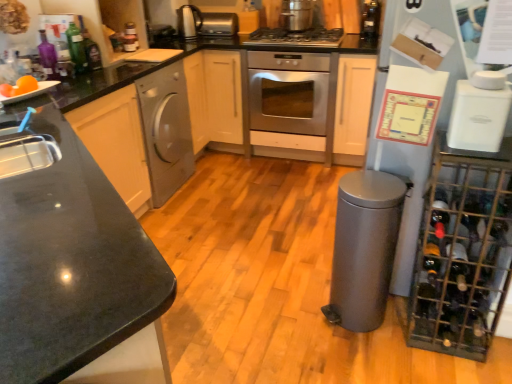
This screenshot has width=512, height=384. In order to click on purple glass bottle at upper left, the first bottle in the front-to-back sequence in this screenshot , I will do `click(48, 56)`.

The width and height of the screenshot is (512, 384). What do you see at coordinates (73, 265) in the screenshot?
I see `black granite countertop at left` at bounding box center [73, 265].

What do you see at coordinates (466, 251) in the screenshot?
I see `metallic wire wine rack at right` at bounding box center [466, 251].

What are the coordinates of `metallic gray refrigerator at right` in the screenshot? It's located at (412, 62).

Locate an element on the screen. Image resolution: width=512 pixels, height=384 pixels. dark glass wine bottle at lower right is located at coordinates (458, 259).

This screenshot has height=384, width=512. Identify the location of purple glass bottle at upper left, arranged as the 4th bottle when viewed from the right. (48, 56).

Based on the photo, considering the relative positions of white plastic appliance at upper right, acting as the second kitchen appliance starting from the left, and stainless steel gas stove at center in the image provided, is white plastic appliance at upper right, acting as the second kitchen appliance starting from the left, to the right of stainless steel gas stove at center from the viewer's perspective?

Correct, you'll find white plastic appliance at upper right, acting as the second kitchen appliance starting from the left, to the right of stainless steel gas stove at center.

Considering the sizes of objects white plastic appliance at upper right, positioned as the first kitchen appliance in front-to-back order, and stainless steel gas stove at center in the image provided, who is wider, white plastic appliance at upper right, positioned as the first kitchen appliance in front-to-back order, or stainless steel gas stove at center?

With larger width is stainless steel gas stove at center.

Is white plastic appliance at upper right, the 1th kitchen appliance when ordered from right to left, inside the boundaries of stainless steel gas stove at center, or outside?

white plastic appliance at upper right, the 1th kitchen appliance when ordered from right to left, is located beyond the bounds of stainless steel gas stove at center.

Is polished stainless steel kettle at upper left, acting as the 3th appliance starting from the right, far away from translucent glass bottle at upper right, positioned as the first bottle in back-to-front order?

Yes, polished stainless steel kettle at upper left, acting as the 3th appliance starting from the right, and translucent glass bottle at upper right, positioned as the first bottle in back-to-front order, are located far from each other.

From the picture: What's the angular difference between polished stainless steel kettle at upper left, which ranks as the 1th appliance in left-to-right order, and translucent glass bottle at upper right, placed as the fourth bottle when sorted from left to right,'s facing directions?

There is a 1.93-degree angle between the facing directions of polished stainless steel kettle at upper left, which ranks as the 1th appliance in left-to-right order, and translucent glass bottle at upper right, placed as the fourth bottle when sorted from left to right.

Is the depth of polished stainless steel kettle at upper left, acting as the 3th appliance starting from the right, greater than that of translucent glass bottle at upper right, placed as the fourth bottle when sorted from left to right?

That is True.

Looking at this image, between polished stainless steel kettle at upper left, acting as the 3th appliance starting from the right, and translucent glass bottle at upper right, the first bottle in the right-to-left sequence, which one has more height?

Standing taller between the two is translucent glass bottle at upper right, the first bottle in the right-to-left sequence.

From a real-world perspective, between polished stainless steel kettle at upper left, arranged as the second appliance when viewed from the back, and stainless steel pot at upper center, which ranks as the 1th kitchen appliance in left-to-right order, who is vertically lower?

From a 3D spatial view, stainless steel pot at upper center, which ranks as the 1th kitchen appliance in left-to-right order, is below.

Is polished stainless steel kettle at upper left, which ranks as the 1th appliance in left-to-right order, facing away from stainless steel pot at upper center, which is the first kitchen appliance from back to front?

polished stainless steel kettle at upper left, which ranks as the 1th appliance in left-to-right order, does not have its back to stainless steel pot at upper center, which is the first kitchen appliance from back to front.

You are a GUI agent. You are given a task and a screenshot of the screen. Output one action in this format:
    pyautogui.click(x=<x>, y=<y>)
    Task: Click on the 2nd appliance to the left of the stainless steel pot at upper center, the 2th kitchen appliance in the front-to-back sequence, counting from the anchor's position
    The width and height of the screenshot is (512, 384).
    Given the screenshot: What is the action you would take?
    pyautogui.click(x=189, y=22)

Measure the distance between polished stainless steel kettle at upper left, acting as the 3th appliance starting from the right, and stainless steel pot at upper center, which is the first kitchen appliance from back to front.

29.72 inches.

Consider the image. From a real-world perspective, between satin silver trash can at lower right, arranged as the 1th appliance when viewed from the front, and black granite countertop at left, who is vertically lower?

satin silver trash can at lower right, arranged as the 1th appliance when viewed from the front, is physically lower.

Which is less distant, (381, 299) or (57, 137)?

The point (381, 299) is closer.

Is satin silver trash can at lower right, arranged as the 1th appliance when viewed from the front, in front of or behind black granite countertop at left in the image?

Clearly, satin silver trash can at lower right, arranged as the 1th appliance when viewed from the front, is behind black granite countertop at left.

Which of these two, satin silver trash can at lower right, arranged as the 1th appliance when ordered from the bottom, or black granite countertop at left, stands taller?

black granite countertop at left.

The height and width of the screenshot is (384, 512). What are the coordinates of `wine rack that is in front of the polished stainless steel kettle at upper left, acting as the 3th appliance starting from the right` in the screenshot? It's located at (466, 251).

Is metallic wire wine rack at right facing towards polished stainless steel kettle at upper left, arranged as the second appliance when viewed from the back?

No, metallic wire wine rack at right is not turned towards polished stainless steel kettle at upper left, arranged as the second appliance when viewed from the back.

Looking at the image, does metallic wire wine rack at right seem bigger or smaller compared to polished stainless steel kettle at upper left, which ranks as the 1th appliance in left-to-right order?

Considering their sizes, metallic wire wine rack at right takes up more space than polished stainless steel kettle at upper left, which ranks as the 1th appliance in left-to-right order.

Considering the points (495, 178) and (180, 36), which point is behind, point (495, 178) or point (180, 36)?

The point (180, 36) is farther from the camera.

Is stainless steel gas stove at center next to metallic gray refrigerator at right?

No.

From the image's perspective, would you say stainless steel gas stove at center is shown under metallic gray refrigerator at right?

Incorrect, from the image's perspective, stainless steel gas stove at center is higher than metallic gray refrigerator at right.

Which of these two, stainless steel gas stove at center or metallic gray refrigerator at right, is wider?

Wider between the two is stainless steel gas stove at center.

Is stainless steel gas stove at center oriented towards metallic gray refrigerator at right?

No, stainless steel gas stove at center is not facing towards metallic gray refrigerator at right.

Is white plastic appliance at upper right, the second kitchen appliance viewed from the top, at the right side of orange matte at left?

Indeed, white plastic appliance at upper right, the second kitchen appliance viewed from the top, is positioned on the right side of orange matte at left.

Between white plastic appliance at upper right, acting as the second kitchen appliance starting from the left, and orange matte at left, which one has less height?

Standing shorter between the two is orange matte at left.

Between white plastic appliance at upper right, the second kitchen appliance viewed from the top, and orange matte at left, which one has smaller size?

orange matte at left.

This screenshot has width=512, height=384. What are the coordinates of `kitchen appliance in front of the stainless steel gas stove at center` in the screenshot? It's located at (478, 118).

From a real-world perspective, starting from the translucent glass bottle at upper right, positioned as the first bottle in back-to-front order, which appliance is the 1st one below it? Please provide its 2D coordinates.

[(189, 22)]

From the image, which object appears to be farther from metallic wire wine rack at right, black granite countertop at left or satin silver trash can at lower right, the 3th appliance viewed from the back?

Based on the image, black granite countertop at left appears to be further to metallic wire wine rack at right.

Estimate the real-world distances between objects in this image. Which object is further from satin silver trash can at lower right, arranged as the 1th appliance when ordered from the bottom, stainless steel pot at upper center, the 2th kitchen appliance in the front-to-back sequence, or stainless steel gas stove at center?

stainless steel pot at upper center, the 2th kitchen appliance in the front-to-back sequence, is further to satin silver trash can at lower right, arranged as the 1th appliance when ordered from the bottom.

Based on the photo, when comparing their distances from satin silver trash can at lower right, the first appliance in the right-to-left sequence, does dark glass wine bottle at lower right or orange matte at left seem further?

The object further to satin silver trash can at lower right, the first appliance in the right-to-left sequence, is orange matte at left.

Based on their spatial positions, is green glass bottle at upper left, the 3th bottle positioned from the bottom, or white plastic appliance at upper right, acting as the second kitchen appliance starting from the left, closer to purple glass bottle at upper left, arranged as the 4th bottle when viewed from the right?

green glass bottle at upper left, the 3th bottle positioned from the bottom.

Based on their spatial positions, is metallic gray refrigerator at right or stainless steel gas stove at center closer to purple glass bottle at upper left, the 4th bottle when ordered from back to front?

Among the two, stainless steel gas stove at center is located nearer to purple glass bottle at upper left, the 4th bottle when ordered from back to front.

Estimate the real-world distances between objects in this image. Which object is closer to stainless steel oven at center, translucent glass bottle at upper right, positioned as the first bottle in back-to-front order, or green glass bottle at upper left, marked as the second bottle in a back-to-front arrangement?

translucent glass bottle at upper right, positioned as the first bottle in back-to-front order, is closer to stainless steel oven at center.

Looking at the image, which one is located further to polished stainless steel kettle at upper left, which ranks as the second appliance in top-to-bottom order, stainless steel pot at upper center, which is counted as the 1th kitchen appliance, starting from the top, or green glass bottle at upper left, placed as the 3th bottle when sorted from right to left?

green glass bottle at upper left, placed as the 3th bottle when sorted from right to left, is positioned further to the anchor polished stainless steel kettle at upper left, which ranks as the second appliance in top-to-bottom order.

Estimate the real-world distances between objects in this image. Which object is closer to metallic gray refrigerator at right, dark glass wine bottle at lower right or white plastic appliance at upper right, the second kitchen appliance viewed from the top?

white plastic appliance at upper right, the second kitchen appliance viewed from the top, lies closer to metallic gray refrigerator at right than the other object.

This screenshot has height=384, width=512. Find the location of `appliance between polished stainless steel kettle at upper left, arranged as the second appliance when viewed from the back, and stainless steel pot at upper center, the 2th kitchen appliance in the front-to-back sequence, in the horizontal direction`. appliance between polished stainless steel kettle at upper left, arranged as the second appliance when viewed from the back, and stainless steel pot at upper center, the 2th kitchen appliance in the front-to-back sequence, in the horizontal direction is located at coordinates (219, 24).

Locate an element on the screen. Image resolution: width=512 pixels, height=384 pixels. appliance between metallic gray refrigerator at right and stainless steel gas stove at center in the front-back direction is located at coordinates (364, 248).

Where is `wine rack situated between black granite countertop at left and metallic gray refrigerator at right from left to right`? Image resolution: width=512 pixels, height=384 pixels. wine rack situated between black granite countertop at left and metallic gray refrigerator at right from left to right is located at coordinates (466, 251).

Identify the location of bottle between green glass bottle at upper left, which appears as the 2th bottle when viewed from the top, and stainless steel pot at upper center, which ranks as the 1th kitchen appliance in left-to-right order, from left to right. (91, 51).